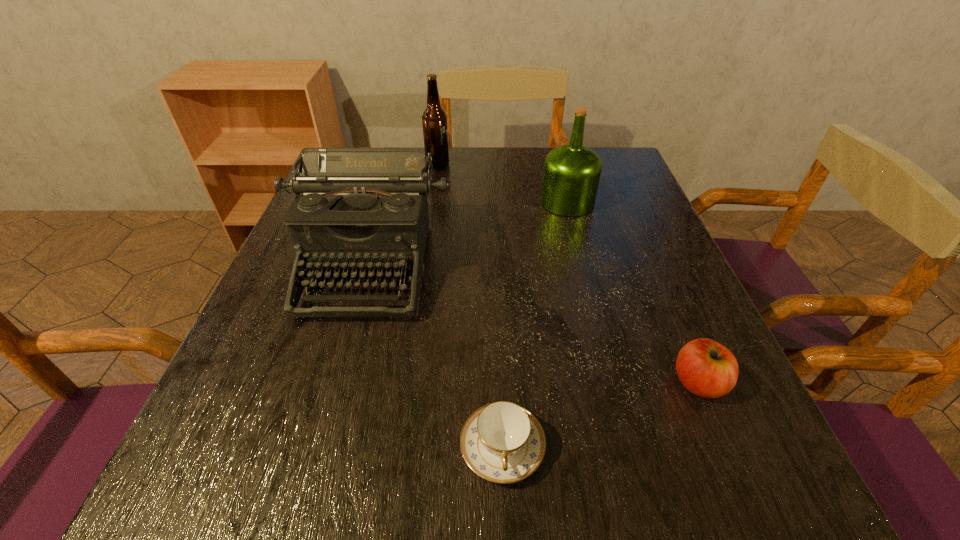
Identify the location of beer bottle. The width and height of the screenshot is (960, 540). (434, 118).

Find the location of a particular element. The image size is (960, 540). olive oil is located at coordinates (571, 174).

Locate an element on the screen. The image size is (960, 540). the fourth object from left to right is located at coordinates (571, 174).

Identify the location of the third nearest object. (360, 209).

Locate an element on the screen. Image resolution: width=960 pixels, height=540 pixels. typewriter is located at coordinates (360, 209).

Image resolution: width=960 pixels, height=540 pixels. I want to click on the rightmost object, so click(706, 368).

Where is `apple`? The height and width of the screenshot is (540, 960). apple is located at coordinates (706, 368).

The width and height of the screenshot is (960, 540). I want to click on teacup, so click(x=502, y=442).

Where is `the third object from right to left`? This screenshot has width=960, height=540. the third object from right to left is located at coordinates (502, 442).

You are a GUI agent. You are given a task and a screenshot of the screen. Output one action in this format:
    pyautogui.click(x=<x>, y=<y>)
    Task: Click on the vacant space located 0.130m on the label of the farthest object
    The image size is (960, 540).
    Given the screenshot: What is the action you would take?
    pyautogui.click(x=496, y=166)